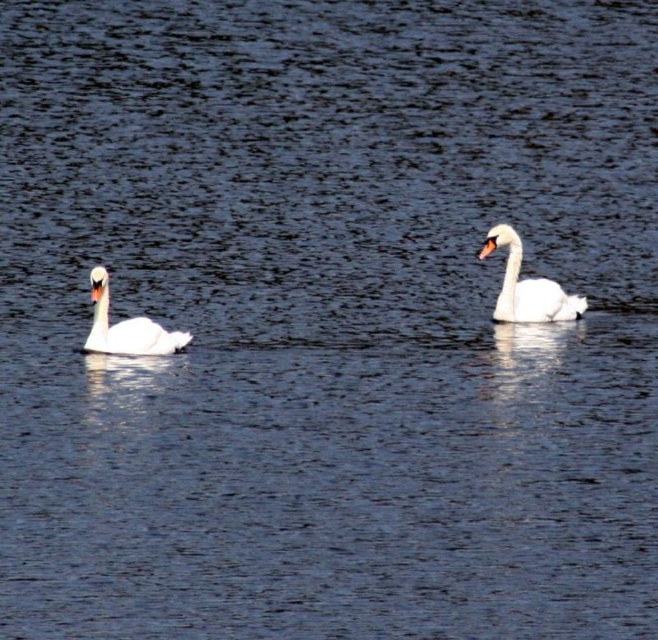
Where is `white glossy swan at right`? white glossy swan at right is located at coordinates (526, 285).

Where is `white glossy swan at right`? This screenshot has height=640, width=658. white glossy swan at right is located at coordinates (526, 285).

Where is `white glossy swan at right`? The height and width of the screenshot is (640, 658). white glossy swan at right is located at coordinates (526, 285).